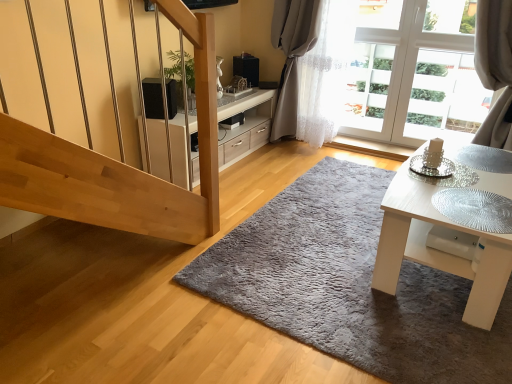
Based on the photo, what is the approximate width of white sheer curtain at upper right?

white sheer curtain at upper right is 30.05 centimeters in width.

Measure the distance between black matte speaker at upper center and camera.

black matte speaker at upper center and camera are 2.85 meters apart.

The image size is (512, 384). What are the coordinates of `black matte speaker at upper center` in the screenshot? It's located at (153, 98).

Identify the location of gray fluffy rug at center. The height and width of the screenshot is (384, 512). coord(349,285).

From a real-world perspective, is white glossy table at lower right over gray fluffy rug at center?

Yes, from a real-world perspective, white glossy table at lower right is over gray fluffy rug at center

Does point (391, 229) come behind point (381, 304)?

No, it is not.

Would you say white glossy table at lower right is a long distance from gray fluffy rug at center?

white glossy table at lower right is actually quite close to gray fluffy rug at center.

From the image's perspective, between black matte speaker at upper center and gray fluffy rug at center, which one is located above?

black matte speaker at upper center appears higher in the image.

Considering the positions of objects black matte speaker at upper center and gray fluffy rug at center in the image provided, who is more to the right, black matte speaker at upper center or gray fluffy rug at center?

Positioned to the right is gray fluffy rug at center.

Can we say black matte speaker at upper center lies outside gray fluffy rug at center?

Yes, black matte speaker at upper center is not within gray fluffy rug at center.

Is point (147, 96) less distant than point (350, 218)?

No, it is behind (350, 218).

From their relative heights in the image, would you say gray fluffy rug at center is taller or shorter than white glossy table at lower right?

Clearly, gray fluffy rug at center is shorter compared to white glossy table at lower right.

From the image's perspective, who appears lower, gray fluffy rug at center or white glossy table at lower right?

From the image's view, gray fluffy rug at center is below.

From the picture: Is gray fluffy rug at center oriented away from white glossy table at lower right?

No, gray fluffy rug at center is not facing away from white glossy table at lower right.

Is gray fluffy rug at center not inside white glossy cabinet at center?

gray fluffy rug at center lies outside white glossy cabinet at center's area.

Which is more to the right, gray fluffy rug at center or white glossy cabinet at center?

From the viewer's perspective, gray fluffy rug at center appears more on the right side.

This screenshot has height=384, width=512. Identify the location of doormat directly beneath the white glossy cabinet at center (from a real-world perspective). (349, 285).

Is white glossy table at lower right shorter than black matte speaker at upper center?

No, white glossy table at lower right is not shorter than black matte speaker at upper center.

From the image's perspective, is white glossy table at lower right located above black matte speaker at upper center?

No, from the image's perspective, white glossy table at lower right is not above black matte speaker at upper center.

From a real-world perspective, is white glossy table at lower right positioned above or below black matte speaker at upper center?

Clearly, from a real-world perspective, white glossy table at lower right is below black matte speaker at upper center.

Which object is more forward, white glossy table at lower right or black matte speaker at upper center?

white glossy table at lower right is more forward.

How distant is white glossy table at lower right from white sheer curtain at upper right?

white glossy table at lower right is 1.76 meters away from white sheer curtain at upper right.

Relative to white sheer curtain at upper right, is white glossy table at lower right in front or behind?

white glossy table at lower right is positioned closer to the viewer than white sheer curtain at upper right.

Consider the image. From the image's perspective, is white glossy table at lower right under white sheer curtain at upper right?

Yes.

In terms of width, does white glossy table at lower right look wider or thinner when compared to white sheer curtain at upper right?

white glossy table at lower right is wider than white sheer curtain at upper right.

From the image's perspective, which one is positioned lower, black matte speaker at upper center or white sheer curtain at upper right?

black matte speaker at upper center appears lower in the image.

Which of these two, black matte speaker at upper center or white sheer curtain at upper right, is bigger?

white sheer curtain at upper right is bigger.

Is the surface of black matte speaker at upper center in direct contact with white sheer curtain at upper right?

No, black matte speaker at upper center is not making contact with white sheer curtain at upper right.

Is point (151, 78) more distant than point (291, 34)?

No.

Locate an element on the screen. Image resolution: width=512 pixels, height=384 pixels. table behind the gray fluffy rug at center is located at coordinates (435, 250).

Find the location of a particular element. Image resolution: width=512 pixels, height=384 pixels. doormat lying in front of the black matte speaker at upper center is located at coordinates (349, 285).

From the image, which object appears to be farther from black matte speaker at upper center, gray fluffy rug at center or white glossy cabinet at center?

Based on the image, gray fluffy rug at center appears to be further to black matte speaker at upper center.

Based on their spatial positions, is gray fluffy rug at center or white sheer curtain at upper right further from white glossy cabinet at center?

gray fluffy rug at center lies further to white glossy cabinet at center than the other object.

Based on their spatial positions, is black matte speaker at upper center or white sheer curtain at upper right closer to white glossy cabinet at center?

The object closer to white glossy cabinet at center is white sheer curtain at upper right.

Which object lies further to the anchor point white sheer curtain at upper right, black matte speaker at upper center or white glossy cabinet at center?

Among the two, black matte speaker at upper center is located further to white sheer curtain at upper right.

Based on their spatial positions, is white glossy cabinet at center or white glossy table at lower right further from white sheer curtain at upper right?

Among the two, white glossy table at lower right is located further to white sheer curtain at upper right.

Which object lies further to the anchor point gray fluffy rug at center, white glossy cabinet at center or white sheer curtain at upper right?

white sheer curtain at upper right.

Estimate the real-world distances between objects in this image. Which object is closer to white sheer curtain at upper right, white glossy table at lower right or white glossy cabinet at center?

white glossy cabinet at center is positioned closer to the anchor white sheer curtain at upper right.

Which object lies further to the anchor point gray fluffy rug at center, white glossy table at lower right or black matte speaker at upper center?

Among the two, black matte speaker at upper center is located further to gray fluffy rug at center.

I want to click on cabinetry between black matte speaker at upper center and white glossy table at lower right, so click(x=246, y=120).

Find the location of a particular element. cabinetry between gray fluffy rug at center and black matte speaker at upper center from front to back is located at coordinates (246, 120).

This screenshot has height=384, width=512. I want to click on curtain between black matte speaker at upper center and white glossy table at lower right in the horizontal direction, so click(x=297, y=68).

I want to click on cabinetry located between black matte speaker at upper center and white sheer curtain at upper right in the left-right direction, so click(246, 120).